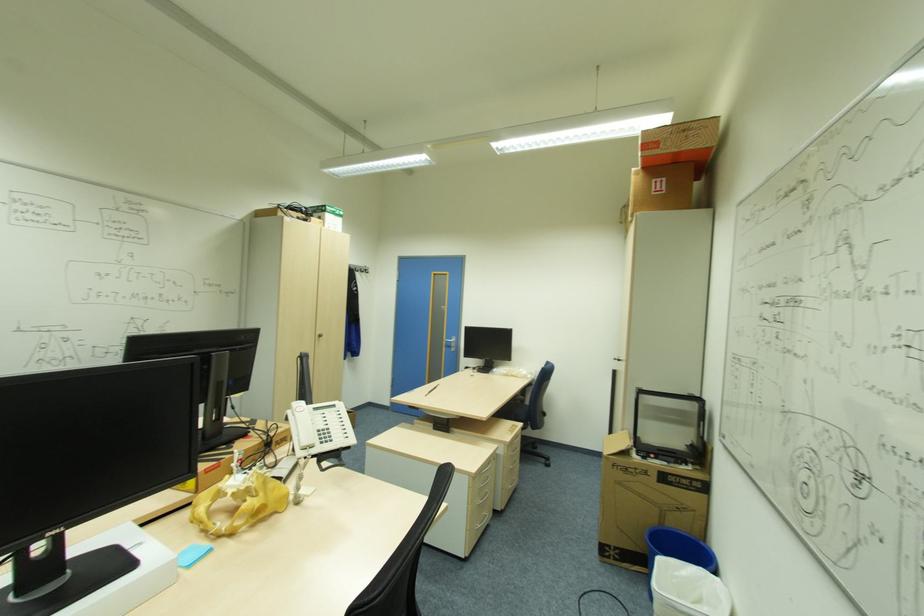
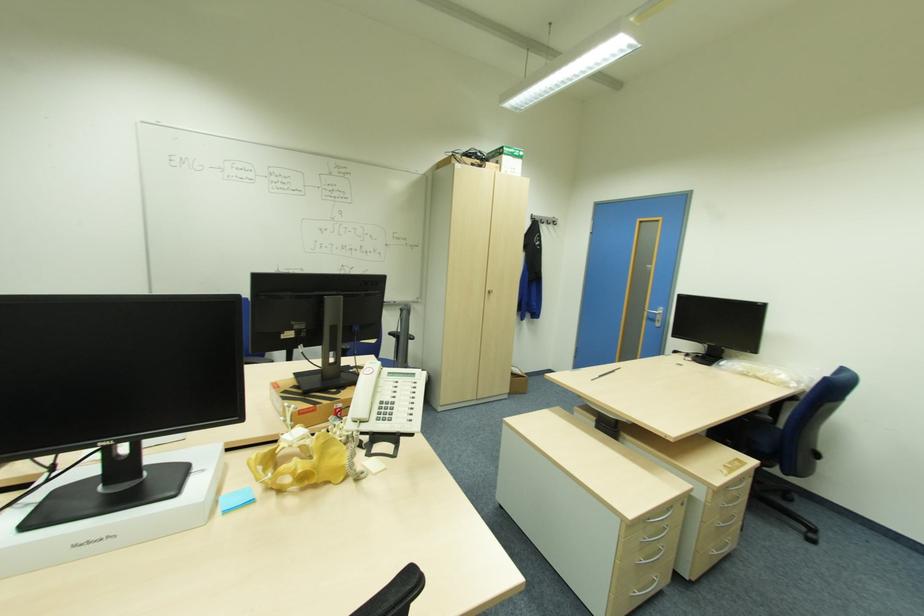
In the second image, find the point that corresponds to point 143,543 in the first image.

(207, 469)